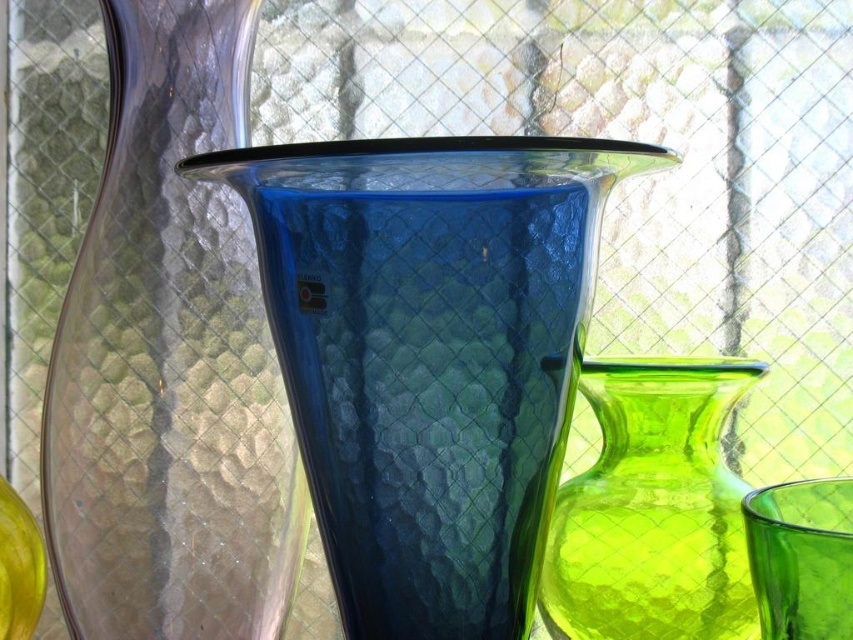
Question: Based on their relative distances, which object is farther from the lime green glass vase at right?

Choices:
 (A) transparent glass vase at left
 (B) blue textured glass pitcher at center

Answer: (A)

Question: Which is farther from the lime green glass vase at right?

Choices:
 (A) transparent glass vase at left
 (B) blue textured glass pitcher at center

Answer: (A)

Question: Does blue textured glass pitcher at center have a larger size compared to transparent glass vase at left?

Choices:
 (A) yes
 (B) no

Answer: (A)

Question: Is blue textured glass pitcher at center above lime green glass vase at right?

Choices:
 (A) no
 (B) yes

Answer: (B)

Question: Which point appears closest to the camera in this image?

Choices:
 (A) (659, 596)
 (B) (335, 563)

Answer: (B)

Question: Is blue textured glass pitcher at center thinner than lime green glass vase at right?

Choices:
 (A) no
 (B) yes

Answer: (A)